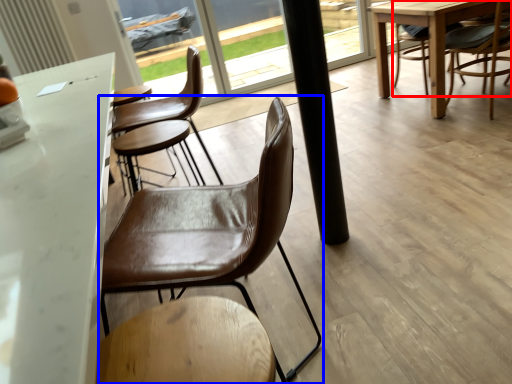
Question: Which object is further to the camera taking this photo, chair (highlighted by a red box) or chair (highlighted by a blue box)?

Choices:
 (A) chair
 (B) chair

Answer: (A)